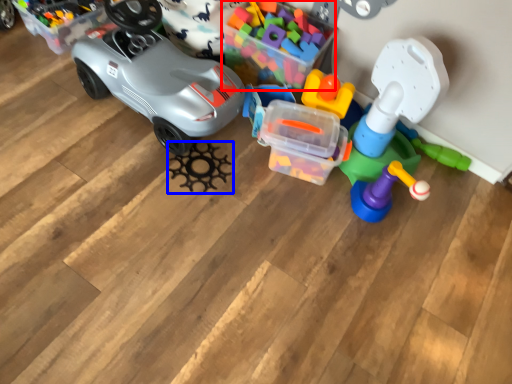
Question: Which object appears closest to the camera in this image, toy (highlighted by a red box) or toy (highlighted by a blue box)?

Choices:
 (A) toy
 (B) toy

Answer: (A)